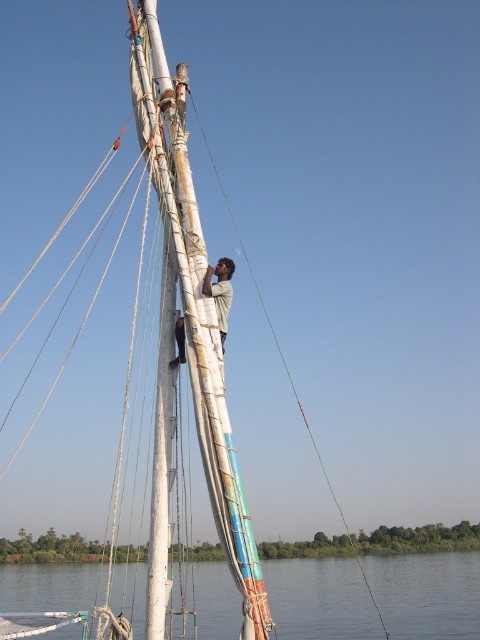
You are standing on the deck of the felucca sailboat and notice the transparent water at lower center and the light brown fabric shirt at center. How far apart are these two objects?

The distance between the transparent water at lower center and the light brown fabric shirt at center is 60.00 meters.

You are standing on the deck of the felucca sailboat and notice the transparent water at lower center and the light brown fabric shirt at center. Which object is positioned to the right of the other?

The light brown fabric shirt at center is to the right of the transparent water at lower center because the transparent water at lower center is located to the left of the light brown fabric shirt at center.

You are standing on the deck of the felucca sailboat and want to retrieve an item that fell into the water. The item is located at point (428, 593). Based on the scene description, is the area at that point covered by water or land?

The area at point (428, 593) is covered by transparent water at lower center, so the item is in the water.